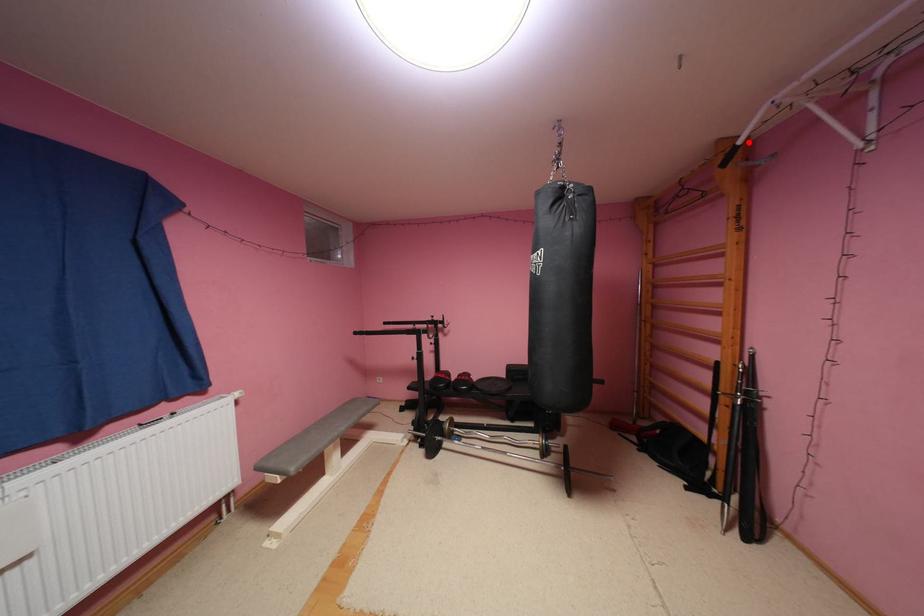
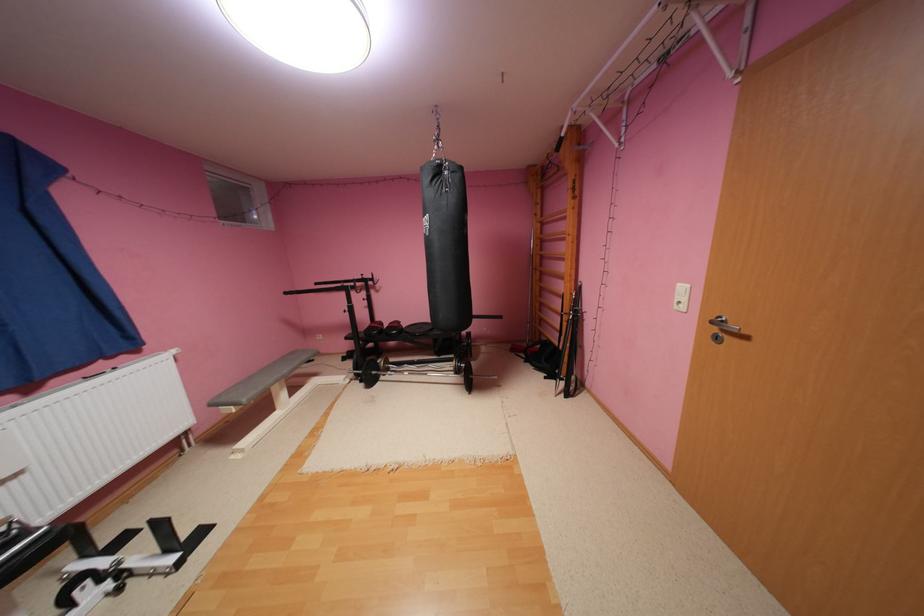
Find the pixel in the second image that matches the highlighted location in the first image.

(572, 135)